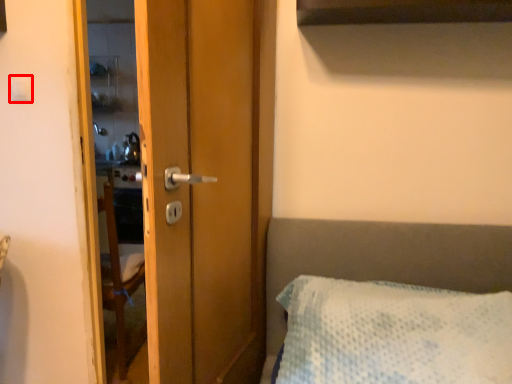
Question: From the image's perspective, considering the relative positions of light switch (annotated by the red box) and screen door in the image provided, where is light switch (annotated by the red box) located with respect to the staircase?

Choices:
 (A) below
 (B) above

Answer: (B)